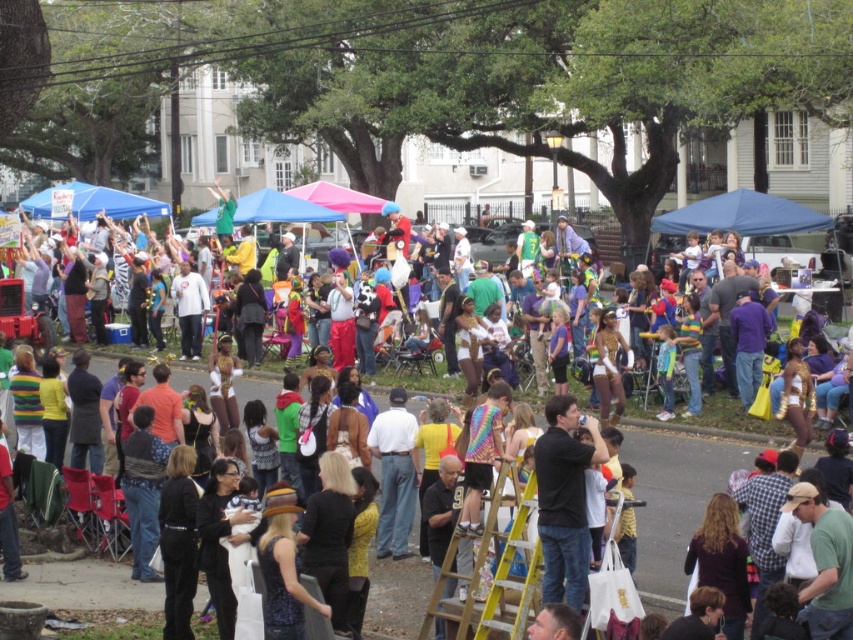
You are standing at the camera position and want to throw a paper airplane to both the point at (440,564) and the point at (558,448). Which point is closer to you?

The point at (440,564) is closer to you because it is further to the camera than the other point.